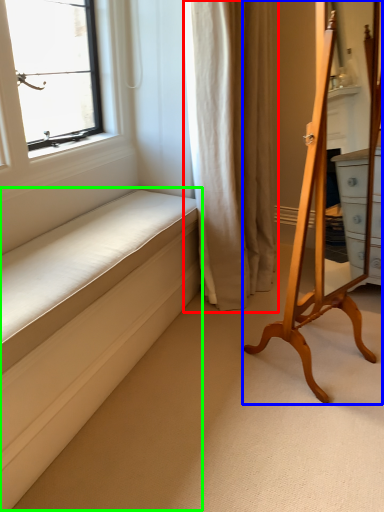
Question: Which object is positioned farthest from curtain (highlighted by a red box)? Select from furniture (highlighted by a blue box) and bed frame (highlighted by a green box).

Choices:
 (A) furniture
 (B) bed frame

Answer: (B)